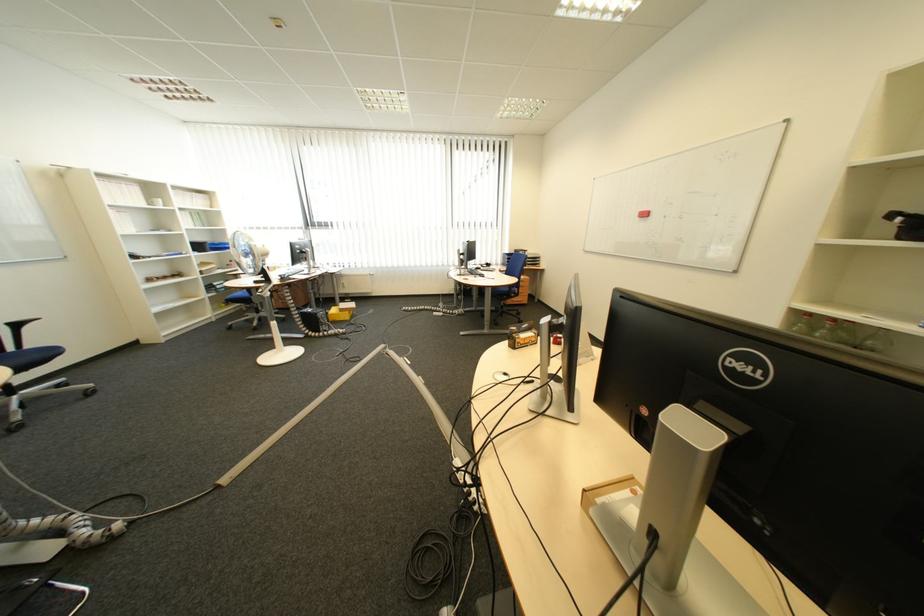
Which object does [686,203] point to?

This point indicates the red board eraser.